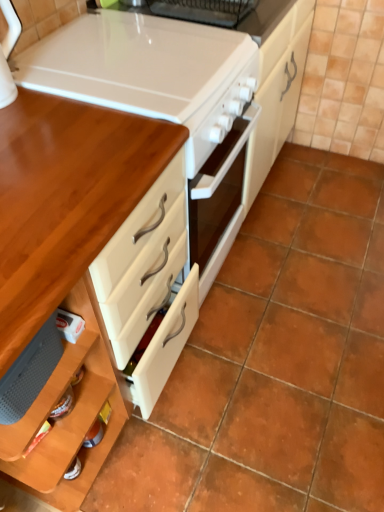
Question: In terms of height, does wooden table at left look taller or shorter compared to white glossy stove at upper center?

Choices:
 (A) short
 (B) tall

Answer: (B)

Question: Based on their positions, is wooden table at left located to the left or right of white glossy stove at upper center?

Choices:
 (A) left
 (B) right

Answer: (A)

Question: Is wooden table at left situated inside white glossy stove at upper center or outside?

Choices:
 (A) inside
 (B) outside

Answer: (B)

Question: Considering the relative positions of white glossy stove at upper center and wooden table at left in the image provided, is white glossy stove at upper center to the left or to the right of wooden table at left?

Choices:
 (A) right
 (B) left

Answer: (A)

Question: Considering the positions of point (79, 18) and point (157, 166), is point (79, 18) closer or farther from the camera than point (157, 166)?

Choices:
 (A) farther
 (B) closer

Answer: (A)

Question: In the image, is white glossy stove at upper center positioned in front of or behind wooden table at left?

Choices:
 (A) behind
 (B) front

Answer: (A)

Question: In terms of size, does white glossy stove at upper center appear bigger or smaller than wooden table at left?

Choices:
 (A) big
 (B) small

Answer: (B)